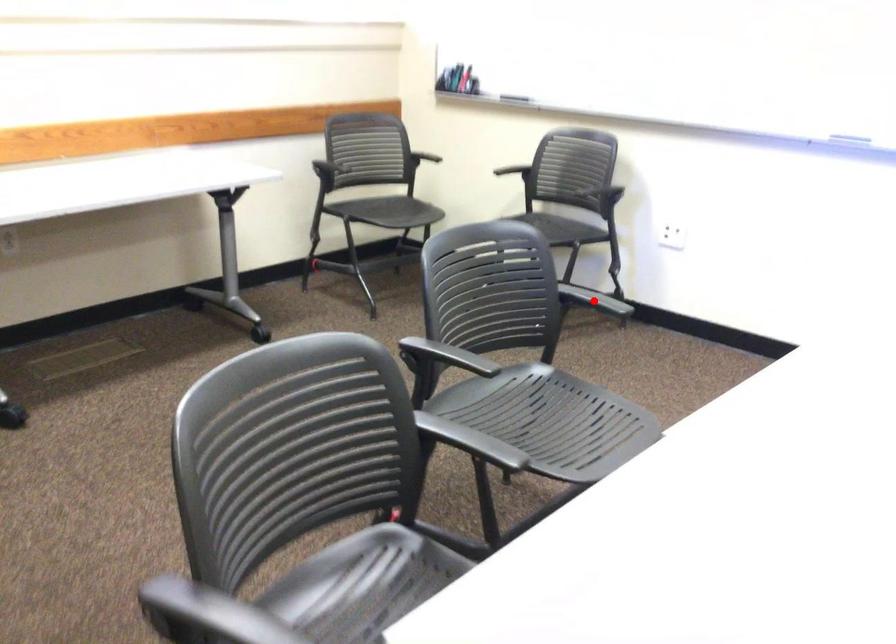
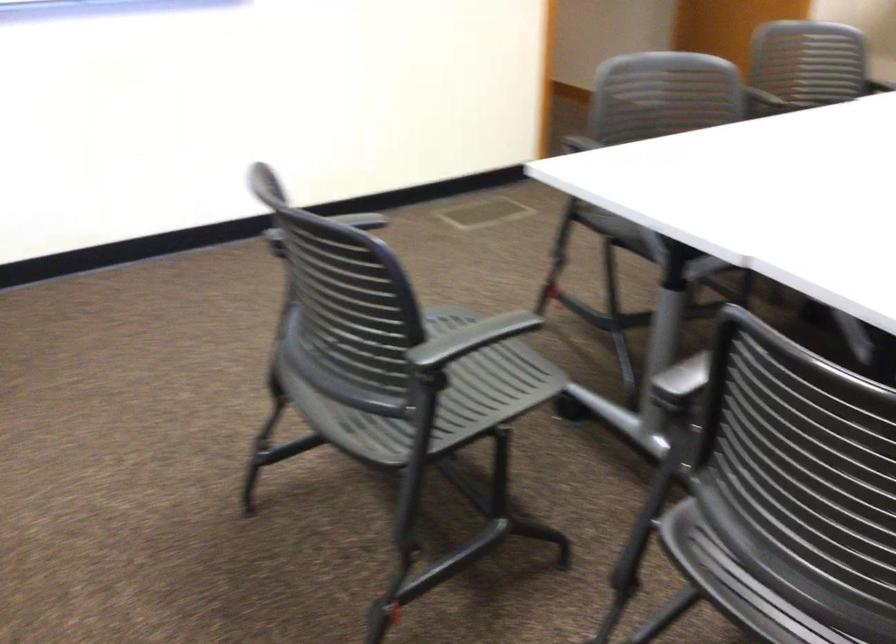
Question: I am providing you with two images of the same scene from different viewpoints. A red point is marked on the first image. At the location where the point appears in image 1, is it still visible in image 2?

Choices:
 (A) Yes
 (B) No

Answer: (B)